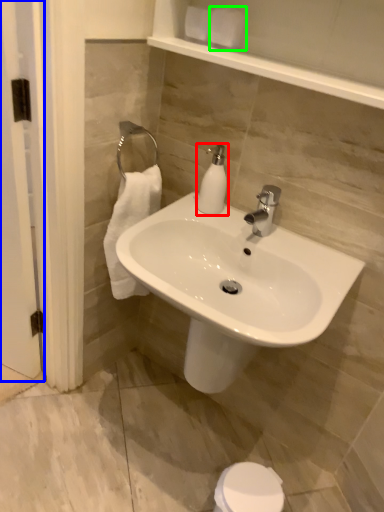
Question: Considering the real-world distances, which object is farthest from soap dispenser (highlighted by a red box)? screen door (highlighted by a blue box) or toilet paper (highlighted by a green box)?

Choices:
 (A) screen door
 (B) toilet paper

Answer: (A)